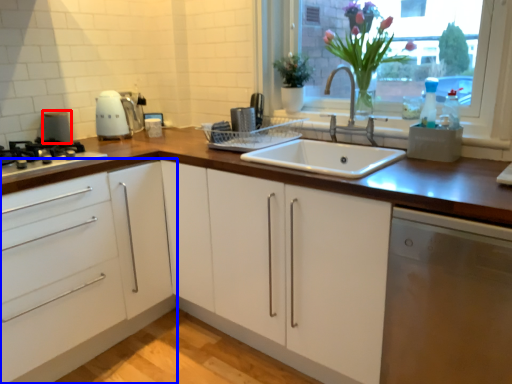
Question: Which of the following is the farthest to the observer, appliance (highlighted by a red box) or cabinetry (highlighted by a blue box)?

Choices:
 (A) appliance
 (B) cabinetry

Answer: (A)